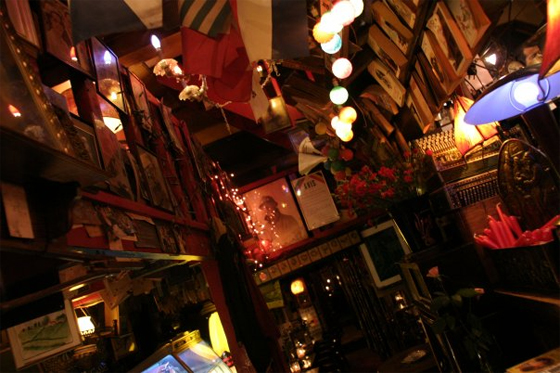
Find the location of a particular element. sconce is located at coordinates click(x=158, y=45).